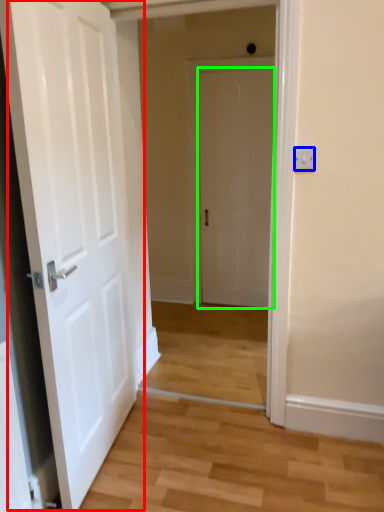
Question: Which object is the closest to the door (highlighted by a red box)? Choose among these: electric outlet (highlighted by a blue box) or door (highlighted by a green box).

Choices:
 (A) electric outlet
 (B) door

Answer: (A)